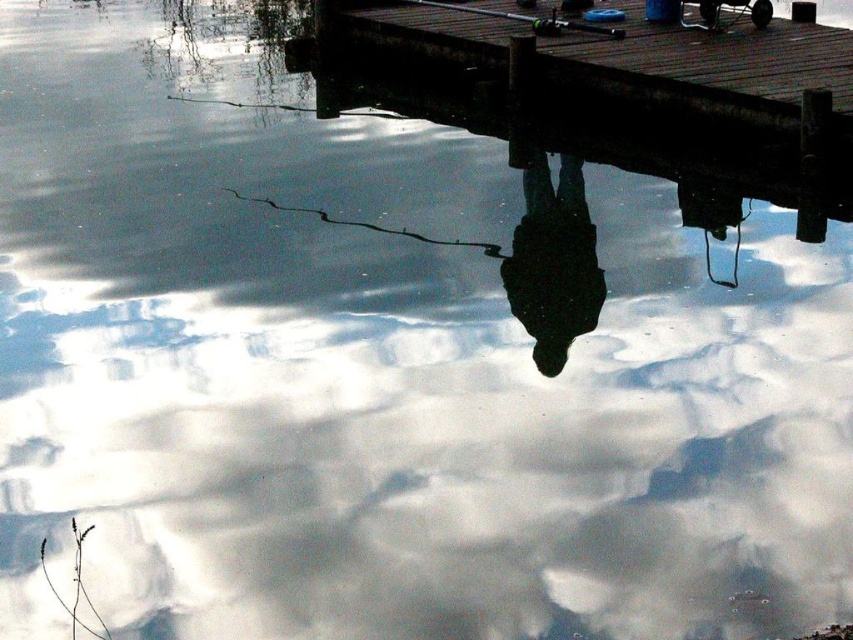
Question: Can you confirm if wooden dock at upper center is wider than black matte figure at center?

Choices:
 (A) yes
 (B) no

Answer: (B)

Question: Where is wooden dock at upper center located in relation to black matte figure at center in the image?

Choices:
 (A) above
 (B) below

Answer: (A)

Question: Does wooden dock at upper center have a smaller size compared to black matte figure at center?

Choices:
 (A) yes
 (B) no

Answer: (A)

Question: Estimate the real-world distances between objects in this image. Which object is farther from the green matte fishing pole at upper center?

Choices:
 (A) black matte figure at center
 (B) wooden dock at upper center

Answer: (A)

Question: Which object is farther from the camera taking this photo?

Choices:
 (A) black matte figure at center
 (B) wooden dock at upper center

Answer: (B)

Question: Which point is farther to the camera?

Choices:
 (A) green matte fishing pole at upper center
 (B) wooden dock at upper center
 (C) black matte figure at center

Answer: (A)